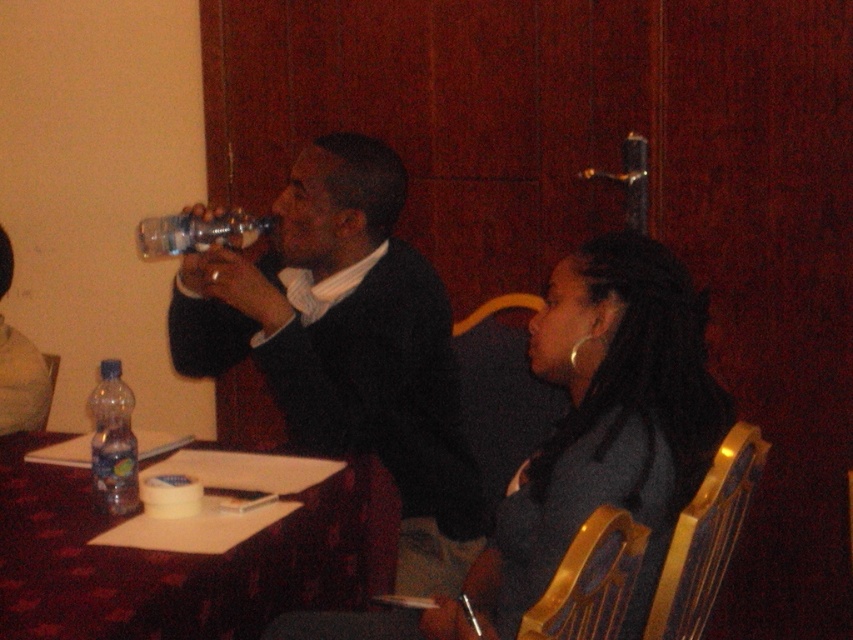
In the scene shown: You are sitting at the table and want to reach for the clear plastic bottle at upper left without moving your chair. Can you reach it while staying seated in the matte plastic chair at lower left?

The clear plastic bottle at upper left is in front of the matte plastic chair at lower left, so you should be able to reach it without moving your chair.

You are standing in the conference room and want to place a new object exactly where the matte black sweater at center is currently located. What are the coordinates you should use for placement?

The coordinates for placing the new object should be at point (341, 330), which is where the matte black sweater at center is located.